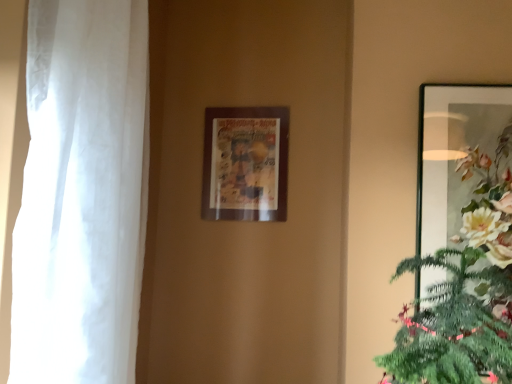
Question: Does white sheer curtain at left appear on the right side of metallic silver picture frame at right, which appears as the second picture frame when viewed from the left?

Choices:
 (A) no
 (B) yes

Answer: (A)

Question: From a real-world perspective, is white sheer curtain at left positioned over metallic silver picture frame at right, which ranks as the 1th picture frame in front-to-back order, based on gravity?

Choices:
 (A) yes
 (B) no

Answer: (B)

Question: Is white sheer curtain at left positioned behind metallic silver picture frame at right, which appears as the second picture frame when viewed from the left?

Choices:
 (A) yes
 (B) no

Answer: (B)

Question: Is white sheer curtain at left bigger than metallic silver picture frame at right, which appears as the second picture frame when viewed from the left?

Choices:
 (A) no
 (B) yes

Answer: (B)

Question: Is white sheer curtain at left oriented away from metallic silver picture frame at right, which is the first picture frame from right to left?

Choices:
 (A) yes
 (B) no

Answer: (B)

Question: From the image's perspective, is wooden picture frame at center, which is the 2th picture frame from right to left, above or below white sheer curtain at left?

Choices:
 (A) above
 (B) below

Answer: (A)

Question: Relative to white sheer curtain at left, is wooden picture frame at center, the 1th picture frame when ordered from left to right, in front or behind?

Choices:
 (A) front
 (B) behind

Answer: (B)

Question: Choose the correct answer: Is wooden picture frame at center, which is the 2th picture frame from front to back, inside white sheer curtain at left or outside it?

Choices:
 (A) outside
 (B) inside

Answer: (A)

Question: Based on their sizes in the image, would you say wooden picture frame at center, which is the 2th picture frame from front to back, is bigger or smaller than white sheer curtain at left?

Choices:
 (A) big
 (B) small

Answer: (B)

Question: From the image's perspective, is white sheer curtain at left above or below wooden picture frame at center, which is the 2th picture frame from right to left?

Choices:
 (A) below
 (B) above

Answer: (A)

Question: From a real-world perspective, is white sheer curtain at left positioned above or below wooden picture frame at center, which is the 2th picture frame from right to left?

Choices:
 (A) above
 (B) below

Answer: (B)

Question: Visually, is white sheer curtain at left positioned to the left or to the right of wooden picture frame at center, which is the 2th picture frame from right to left?

Choices:
 (A) right
 (B) left

Answer: (B)

Question: Is white sheer curtain at left inside the boundaries of wooden picture frame at center, which is the 2th picture frame from right to left, or outside?

Choices:
 (A) outside
 (B) inside

Answer: (A)

Question: From a real-world perspective, relative to wooden picture frame at center, the 1th picture frame when ordered from left to right, is metallic silver picture frame at right, which appears as the second picture frame when viewed from the left, vertically above or below?

Choices:
 (A) above
 (B) below

Answer: (B)

Question: Do you think metallic silver picture frame at right, the second picture frame from the back, is within wooden picture frame at center, which is the 2th picture frame from front to back, or outside of it?

Choices:
 (A) inside
 (B) outside

Answer: (B)